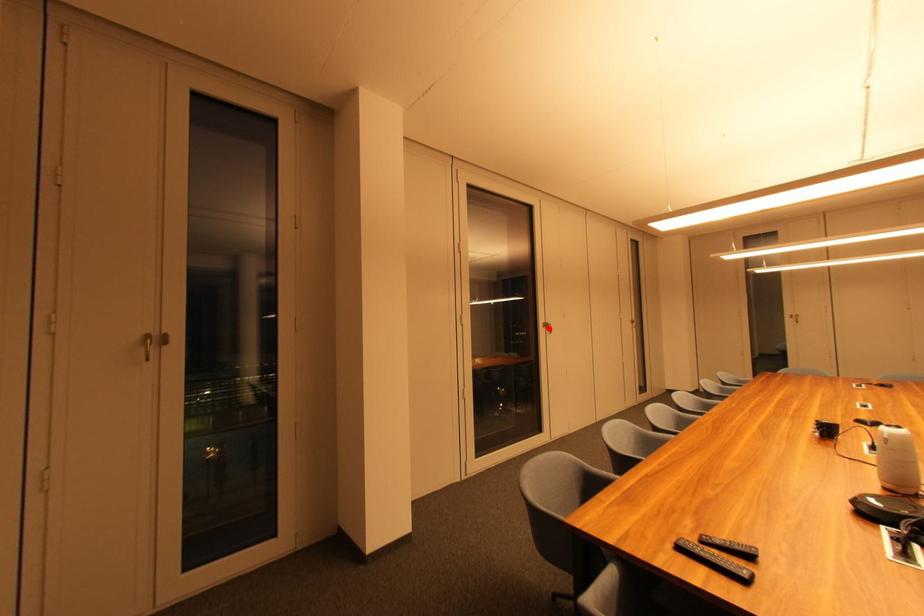
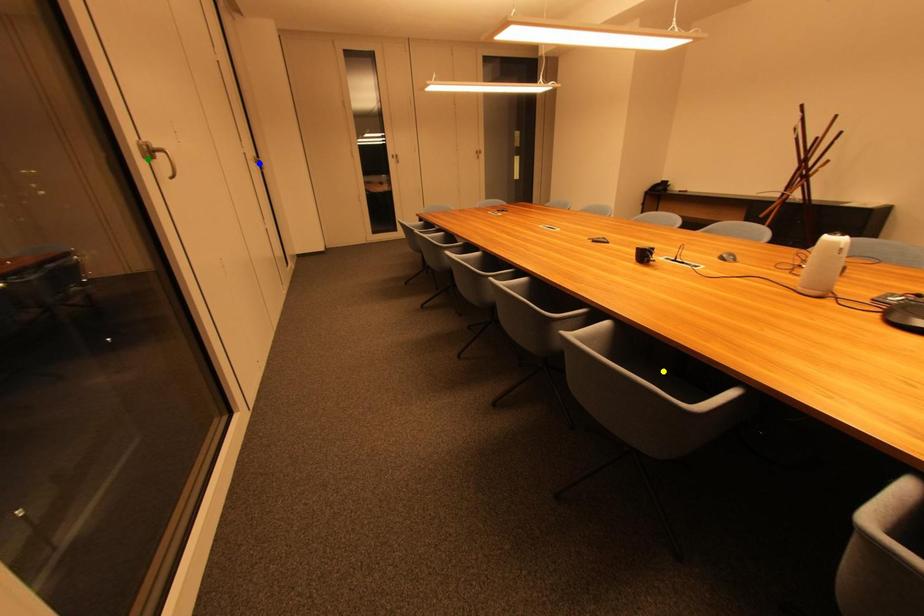
Question: I am providing you with two images of the same scene from different viewpoints. A red point is marked on the first image. You are given multiple points on the second image. Which spot in image 2 lines up with the point in image 1?

Choices:
 (A) blue point
 (B) yellow point
 (C) green point

Answer: (C)